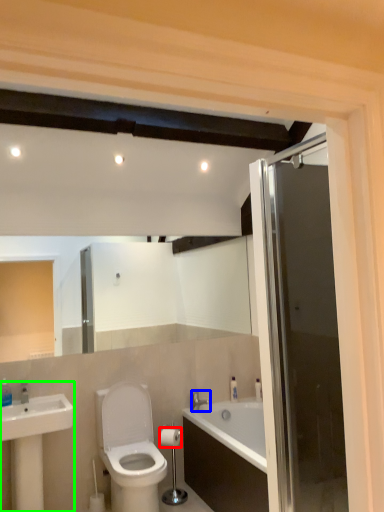
Question: Estimate the real-world distances between objects in this image. Which object is closer to toilet paper (highlighted by a red box), tap (highlighted by a blue box) or sink (highlighted by a green box)?

Choices:
 (A) tap
 (B) sink

Answer: (A)